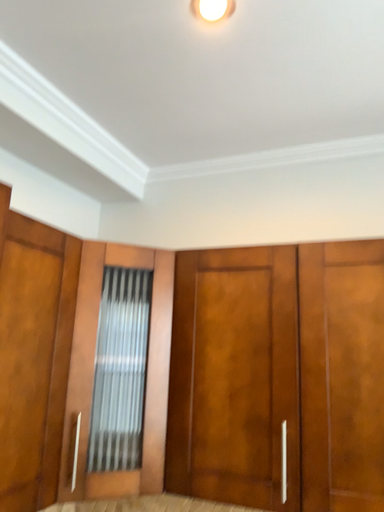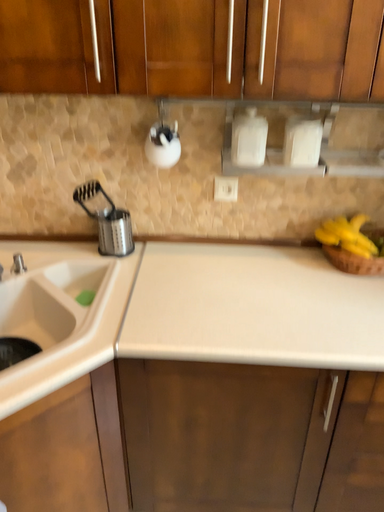
Question: Which way did the camera rotate in the video?

Choices:
 (A) rotated right
 (B) rotated left

Answer: (A)